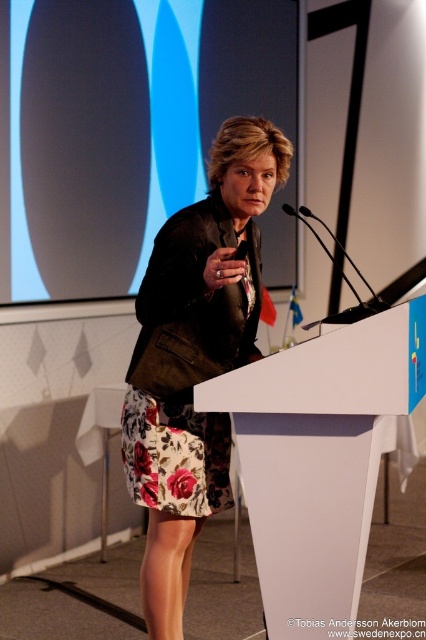
Can you confirm if floral skirt at center is thinner than white plastic podium at center?

Correct, floral skirt at center's width is less than white plastic podium at center's.

I want to click on floral skirt at center, so click(195, 356).